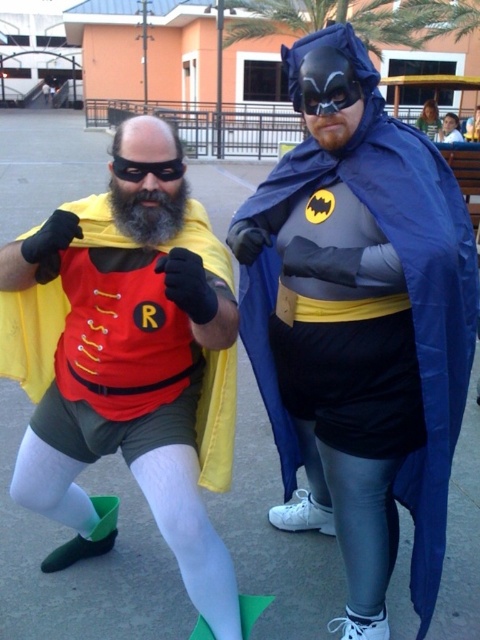
You are a photographer trying to capture the superhero duo. You notice the matte black cape at center and the matte red vest at center. Which one is positioned higher in the image?

The matte black cape at center is positioned higher than the matte red vest at center in the image.

You are a photographer trying to capture a closeup of the matte red vest at center and the smooth plastic cup at upper right. Which object should you focus on first to ensure it appears sharp in the photo?

You should focus on the matte red vest at center first because it is closer to the viewer than the smooth plastic cup at upper right, so focusing on it will ensure it appears sharp while the cup may be slightly out of focus.

You are a photographer trying to capture a closeup of the matte red vest at center. You can only move horizontally. Where should you position yourself relative to the two superheroes to get the best shot?

To capture a closeup of the matte red vest at center, you should position yourself directly in front of the matte red vest at center, which is located at point 0.566 on the horizontal axis. This position will ensure the vest is centered in your frame for the best shot.